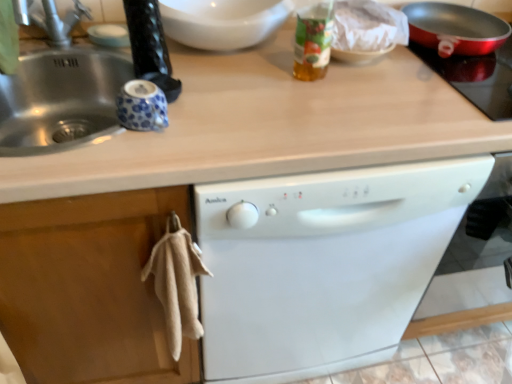
The width and height of the screenshot is (512, 384). I want to click on empty space that is in between white glossy bowl at upper center and translucent plastic bottle at upper center, so click(x=250, y=71).